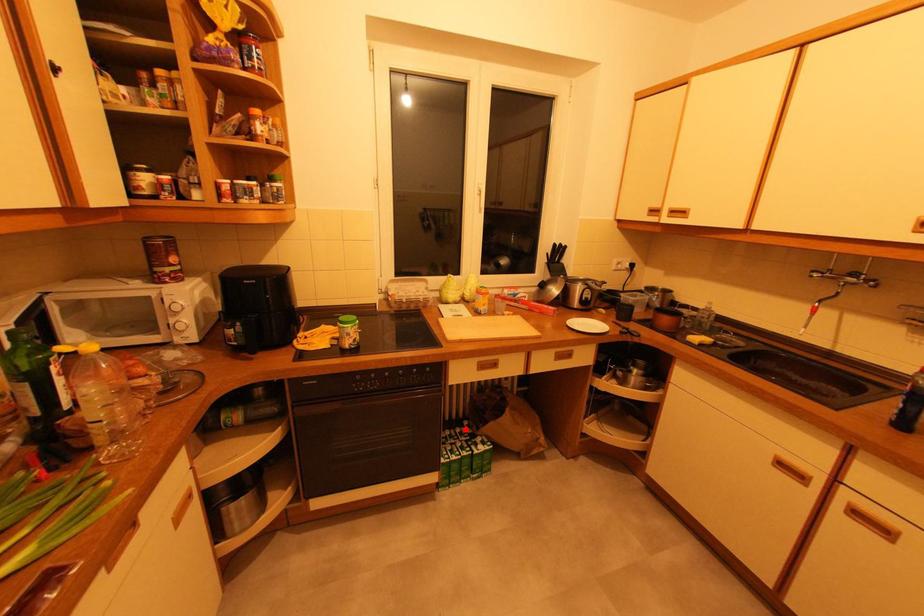
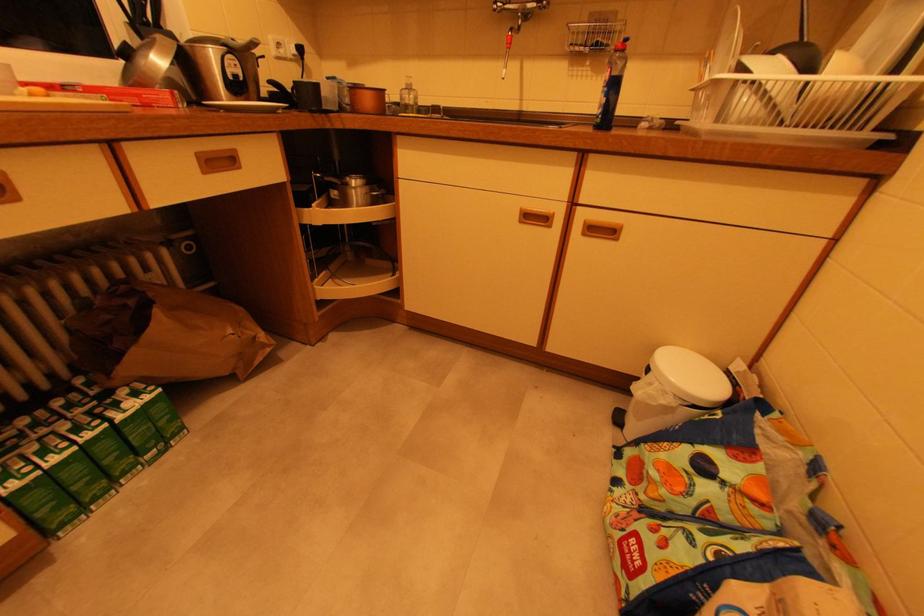
Question: I am providing you with two images of the same scene from different viewpoints. A red point is shown in image1. For the corresponding object point in image2, is it positioned nearer or farther from the camera?

Choices:
 (A) Nearer
 (B) Farther

Answer: (A)